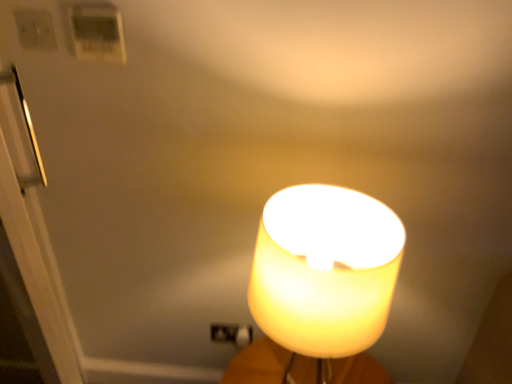
Question: Is translucent yellow lampshade at center in front of white glossy door at left?

Choices:
 (A) yes
 (B) no

Answer: (A)

Question: Is translucent yellow lampshade at center further to camera compared to white glossy door at left?

Choices:
 (A) yes
 (B) no

Answer: (B)

Question: Is translucent yellow lampshade at center far from white glossy door at left?

Choices:
 (A) yes
 (B) no

Answer: (B)

Question: Is translucent yellow lampshade at center oriented towards white glossy door at left?

Choices:
 (A) no
 (B) yes

Answer: (A)

Question: Is translucent yellow lampshade at center thinner than white glossy door at left?

Choices:
 (A) no
 (B) yes

Answer: (A)

Question: Considering the relative sizes of translucent yellow lampshade at center and white glossy door at left in the image provided, is translucent yellow lampshade at center taller than white glossy door at left?

Choices:
 (A) yes
 (B) no

Answer: (B)

Question: Does white glossy door at left contain white plastic thermostat at upper left, arranged as the first light switch when viewed from the right?

Choices:
 (A) no
 (B) yes

Answer: (A)

Question: From the image's perspective, is white glossy door at left beneath white plastic thermostat at upper left, the second light switch in the left-to-right sequence?

Choices:
 (A) no
 (B) yes

Answer: (B)

Question: From a real-world perspective, is white glossy door at left physically below white plastic thermostat at upper left, the second light switch in the left-to-right sequence?

Choices:
 (A) no
 (B) yes

Answer: (B)

Question: Would you consider white glossy door at left to be distant from white plastic thermostat at upper left, the second light switch in the left-to-right sequence?

Choices:
 (A) yes
 (B) no

Answer: (B)

Question: Can you confirm if white glossy door at left is taller than white plastic thermostat at upper left, arranged as the first light switch when viewed from the right?

Choices:
 (A) yes
 (B) no

Answer: (A)

Question: Considering the relative sizes of white glossy door at left and white plastic thermostat at upper left, the second light switch in the left-to-right sequence, in the image provided, is white glossy door at left shorter than white plastic thermostat at upper left, the second light switch in the left-to-right sequence,?

Choices:
 (A) yes
 (B) no

Answer: (B)

Question: Does white plastic thermostat at upper left, arranged as the first light switch when viewed from the right, have a greater height compared to white glossy door at left?

Choices:
 (A) no
 (B) yes

Answer: (A)